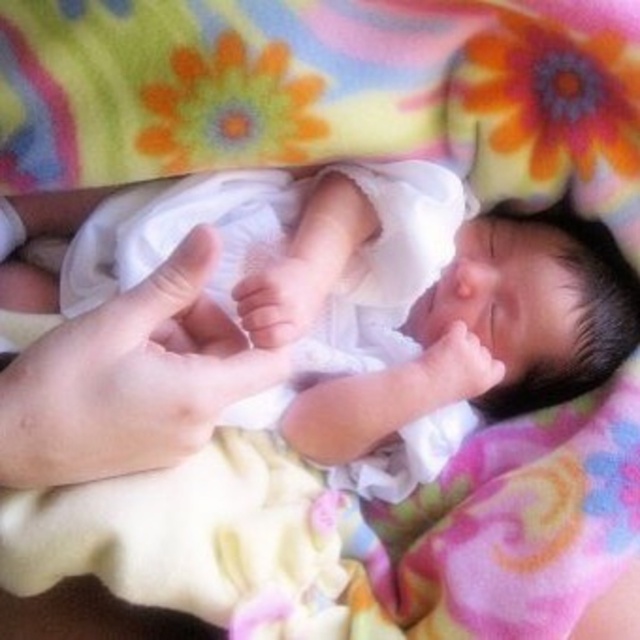
In the image, you see a newborn baby wrapped in a colorful blanket with vibrant floral patterns. There is a white soft cloth at center and a smooth skin hand at lower left. From the perspective of the baby, which object is positioned to its right side?

The white soft cloth at center is to the right of the smooth skin hand at lower left, so from the baby perspective, the white soft cloth at center is positioned to its right side.

Consider the image. You are a photographer taking a close up of a newborn baby wrapped in a colorful blanket. You notice two points marked as point 1 at coordinate (541,296) and point 2 at coordinate (180,448). Which point is closer to the camera?

Point 1 at coordinate (541,296) is further to the camera than point 2 at coordinate (180,448), so point 2 is closer to the camera.